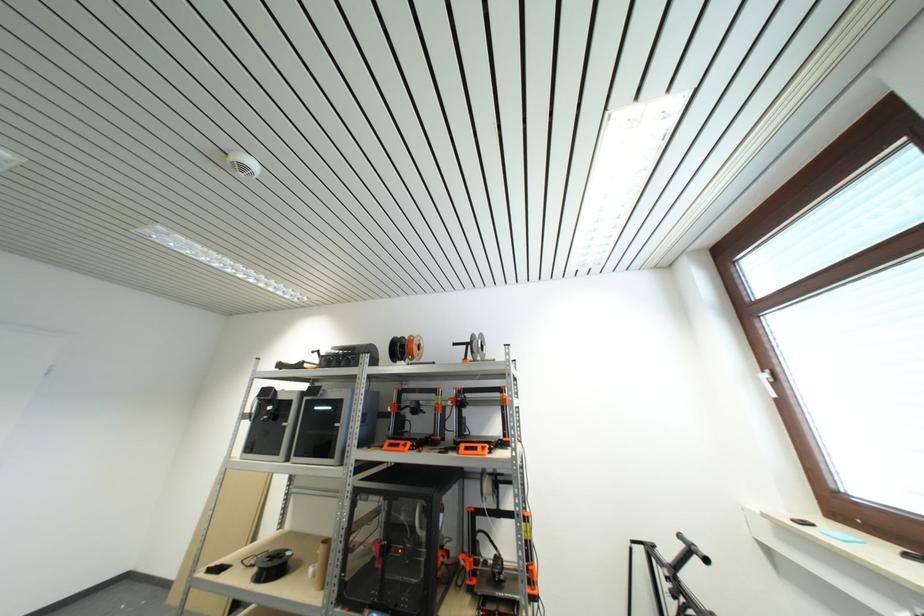
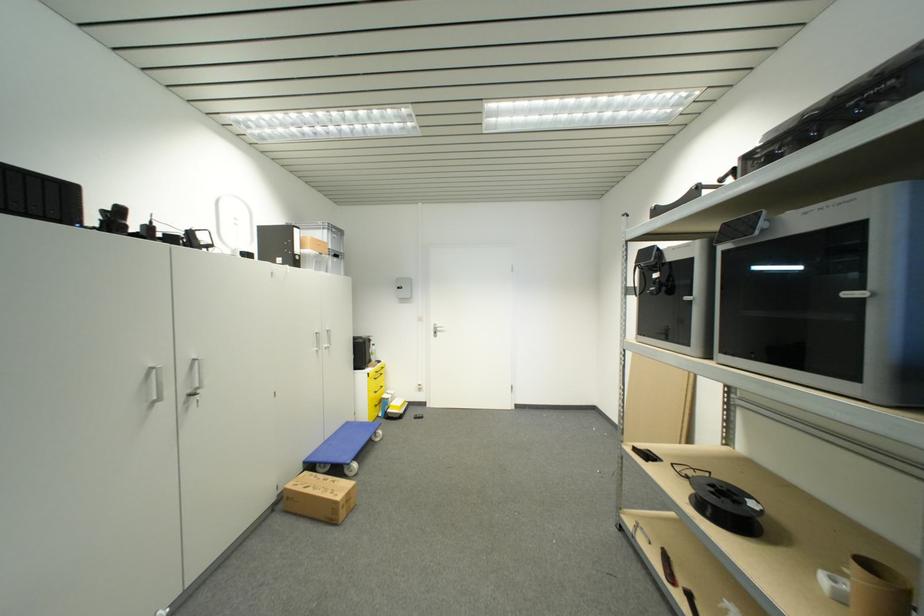
Question: The camera is either moving clockwise (left) or counter-clockwise (right) around the object. The first image is from the beginning of the video and the second image is from the end. Is the camera moving left or right when shooting the video?

Choices:
 (A) Left
 (B) Right

Answer: (B)